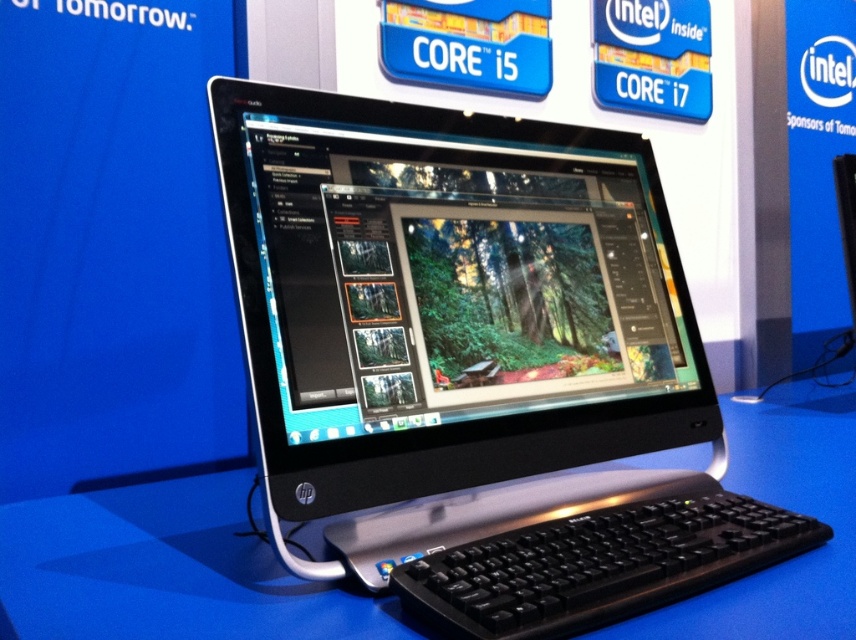
Between point (648, 378) and point (467, 595), which one is positioned in front?

Point (467, 595) is more forward.

Does black plastic monitor at center have a smaller size compared to black plastic keyboard at lower center?

Actually, black plastic monitor at center might be larger than black plastic keyboard at lower center.

Where is `black plastic monitor at center`? This screenshot has height=640, width=856. black plastic monitor at center is located at coordinates (476, 362).

Who is more distant from viewer, (590, 561) or (174, 541)?

The point (174, 541) is behind.

Is point (223, 90) more distant than point (4, 529)?

No, it is in front of (4, 529).

Describe the element at coordinates (476, 362) in the screenshot. I see `black plastic monitor at center` at that location.

Image resolution: width=856 pixels, height=640 pixels. I want to click on black plastic monitor at center, so click(476, 362).

Between black plastic desktop at center and black plastic keyboard at lower center, which one is positioned lower?

black plastic desktop at center

Who is shorter, black plastic desktop at center or black plastic keyboard at lower center?

With less height is black plastic keyboard at lower center.

Is point (281, 637) closer to camera compared to point (623, 589)?

Yes.

This screenshot has width=856, height=640. What are the coordinates of `black plastic desktop at center` in the screenshot? It's located at (165, 570).